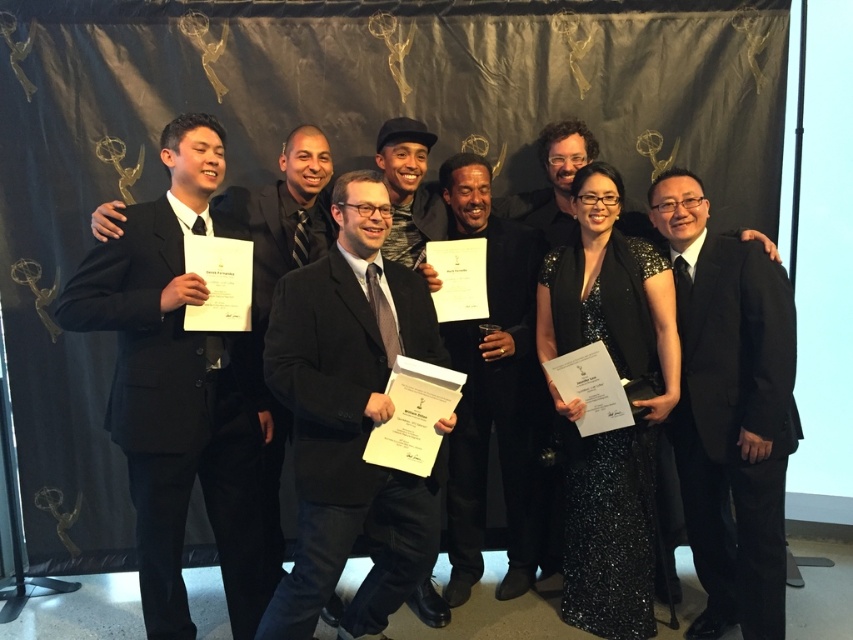
You are a GUI agent. You are given a task and a screenshot of the screen. Output one action in this format:
    pyautogui.click(x=<x>, y=<y>)
    Task: Click on the black velvet suit at center
    This screenshot has width=853, height=640.
    Given the screenshot: What is the action you would take?
    pyautogui.click(x=494, y=388)

From the picture: Does black velvet suit at center appear on the right side of black matte suit at left?

Indeed, black velvet suit at center is positioned on the right side of black matte suit at left.

Which is behind, point (498, 582) or point (276, 278)?

Point (498, 582)

At what (x,y) coordinates should I click in order to perform the action: click on black velvet suit at center. Please return your answer as a coordinate pair (x, y). This screenshot has width=853, height=640. Looking at the image, I should click on (494, 388).

You are a GUI agent. You are given a task and a screenshot of the screen. Output one action in this format:
    pyautogui.click(x=<x>, y=<y>)
    Task: Click on the matte black suit at center
    The width and height of the screenshot is (853, 640).
    Given the screenshot: What is the action you would take?
    pyautogui.click(x=349, y=419)

Can you confirm if matte black suit at center is positioned above black shiny suit at right?

Incorrect, matte black suit at center is not positioned above black shiny suit at right.

The image size is (853, 640). I want to click on matte black suit at center, so click(349, 419).

Is point (285, 376) in front of point (589, 582)?

That is True.

Identify the location of matte black suit at center. (349, 419).

The height and width of the screenshot is (640, 853). I want to click on matte black suit at center, so click(349, 419).